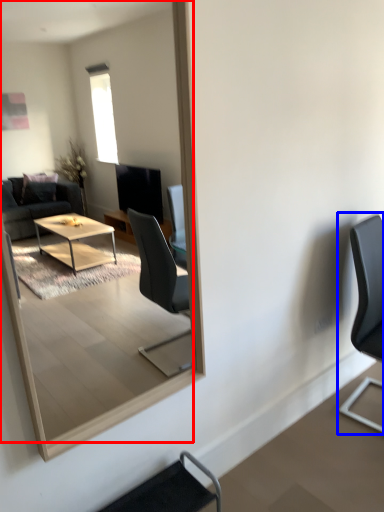
Question: Which of the following is the closest to the observer, mirror (highlighted by a red box) or chair (highlighted by a blue box)?

Choices:
 (A) mirror
 (B) chair

Answer: (A)